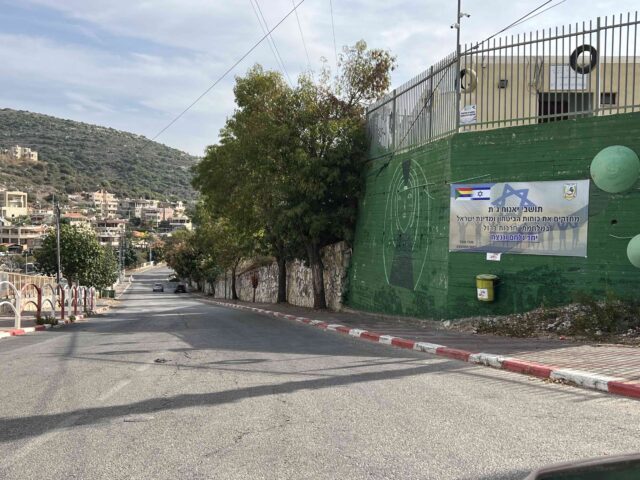
Image resolution: width=640 pixels, height=480 pixels. In order to click on brick wall in this screenshot , I will do `click(524, 157)`.